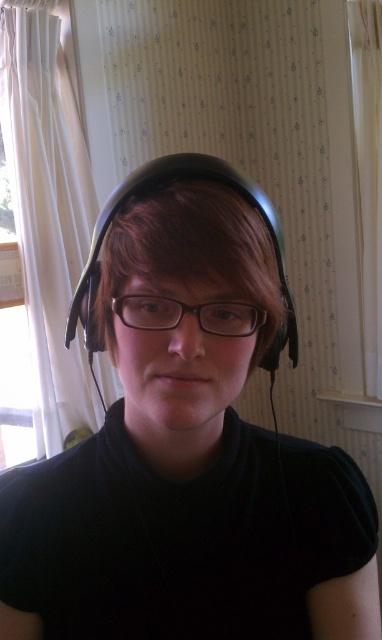
Who is lower down, white sheer curtain at left or transparent plastic glasses at center?

transparent plastic glasses at center is lower down.

Locate an element on the screen. The image size is (382, 640). white sheer curtain at left is located at coordinates (48, 211).

Image resolution: width=382 pixels, height=640 pixels. In order to click on white sheer curtain at left in this screenshot , I will do `click(48, 211)`.

Consider the image. Does black matte headphones at center have a greater height compared to transparent plastic glasses at center?

Yes, black matte headphones at center is taller than transparent plastic glasses at center.

Which is behind, point (189, 480) or point (158, 298)?

The point (189, 480) is behind.

This screenshot has width=382, height=640. In order to click on black matte headphones at center in this screenshot , I will do `click(187, 451)`.

Can you confirm if white sheer curtain at right is shorter than transparent plastic glasses at center?

No, white sheer curtain at right is not shorter than transparent plastic glasses at center.

Can you confirm if white sheer curtain at right is wider than transparent plastic glasses at center?

Correct, the width of white sheer curtain at right exceeds that of transparent plastic glasses at center.

Who is more forward, (370, 369) or (174, 300)?

Positioned in front is point (174, 300).

Find the location of `white sheer curtain at right`. white sheer curtain at right is located at coordinates (369, 172).